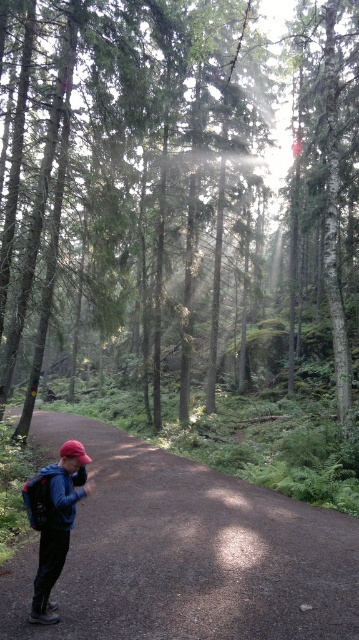
Question: In this image, where is green matte tree at center located relative to brown dirt trail at lower center?

Choices:
 (A) right
 (B) left

Answer: (A)

Question: Which is farther from the green matte tree at center?

Choices:
 (A) matte black backpack at lower left
 (B) matte blue jacket at lower left
 (C) brown dirt trail at lower center

Answer: (A)

Question: Is green matte tree at center thinner than matte blue jacket at lower left?

Choices:
 (A) no
 (B) yes

Answer: (A)

Question: Which point is closer to the camera?

Choices:
 (A) green matte tree at center
 (B) matte blue jacket at lower left

Answer: (B)

Question: Does matte blue jacket at lower left appear under matte black backpack at lower left?

Choices:
 (A) yes
 (B) no

Answer: (A)

Question: Based on their relative distances, which object is nearer to the matte black backpack at lower left?

Choices:
 (A) brown dirt trail at lower center
 (B) green matte tree at center

Answer: (A)